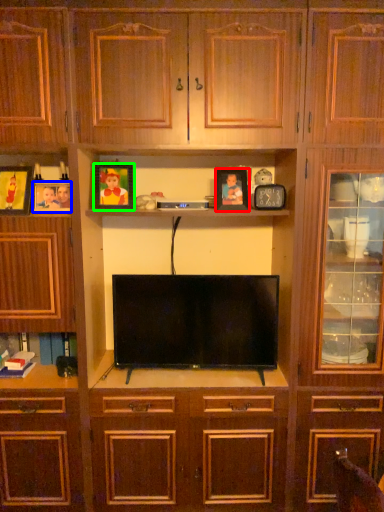
Question: Considering the real-world distances, which object is farthest from picture frame (highlighted by a red box)? picture frame (highlighted by a blue box) or picture frame (highlighted by a green box)?

Choices:
 (A) picture frame
 (B) picture frame

Answer: (A)